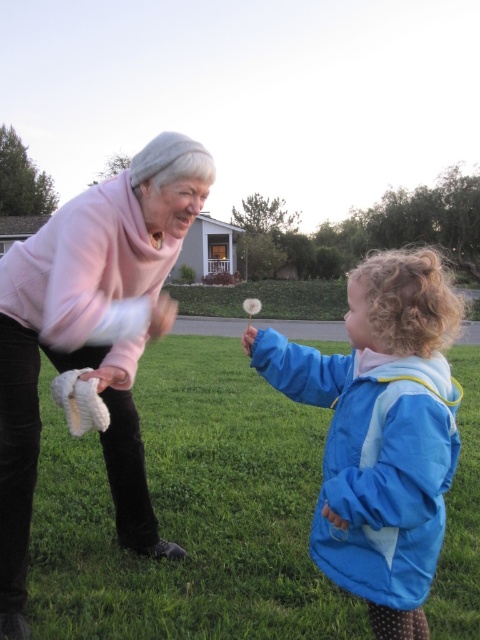
Question: Which object is farther from the camera taking this photo?

Choices:
 (A) blue fabric dandelion at center
 (B) pink fleece sweater at upper left

Answer: (B)

Question: Based on their relative distances, which object is nearer to the blue fabric dandelion at center?

Choices:
 (A) pink fleece sweater at upper left
 (B) green grass at center

Answer: (A)

Question: Where is green grass at center located in relation to pink fleece sweater at upper left in the image?

Choices:
 (A) below
 (B) above

Answer: (A)

Question: Does pink fleece sweater at upper left have a larger size compared to blue fabric dandelion at center?

Choices:
 (A) no
 (B) yes

Answer: (A)

Question: Can you confirm if green grass at center is positioned above pink fleece sweater at upper left?

Choices:
 (A) no
 (B) yes

Answer: (A)

Question: Which object is farther from the camera taking this photo?

Choices:
 (A) blue fabric dandelion at center
 (B) green grass at center

Answer: (B)